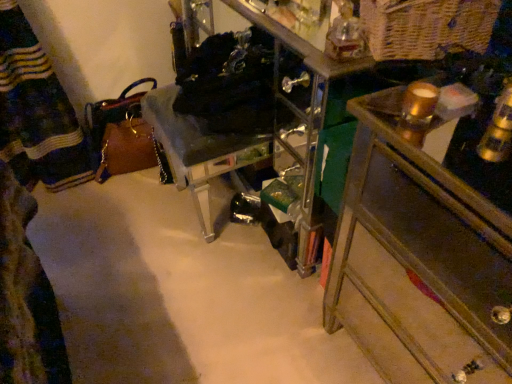
Question: Is there a large distance between woven natural basket at upper right and gold metallic candle at upper right?

Choices:
 (A) yes
 (B) no

Answer: (B)

Question: Is woven natural basket at upper right at the left side of gold metallic candle at upper right?

Choices:
 (A) no
 (B) yes

Answer: (A)

Question: Does woven natural basket at upper right have a greater height compared to gold metallic candle at upper right?

Choices:
 (A) yes
 (B) no

Answer: (A)

Question: Can you confirm if woven natural basket at upper right is wider than gold metallic candle at upper right?

Choices:
 (A) yes
 (B) no

Answer: (A)

Question: Does woven natural basket at upper right come behind gold metallic candle at upper right?

Choices:
 (A) no
 (B) yes

Answer: (B)

Question: Does woven natural basket at upper right have a lesser height compared to gold metallic candle at upper right?

Choices:
 (A) yes
 (B) no

Answer: (B)

Question: Can you confirm if wooden chest of drawers at right is positioned to the right of clear acrylic chair at center?

Choices:
 (A) yes
 (B) no

Answer: (A)

Question: Would you say wooden chest of drawers at right contains clear acrylic chair at center?

Choices:
 (A) yes
 (B) no

Answer: (B)

Question: Is wooden chest of drawers at right far from clear acrylic chair at center?

Choices:
 (A) no
 (B) yes

Answer: (A)

Question: Considering the relative sizes of wooden chest of drawers at right and clear acrylic chair at center in the image provided, is wooden chest of drawers at right thinner than clear acrylic chair at center?

Choices:
 (A) yes
 (B) no

Answer: (B)

Question: Is wooden chest of drawers at right further to the viewer compared to clear acrylic chair at center?

Choices:
 (A) no
 (B) yes

Answer: (A)

Question: Is wooden chest of drawers at right smaller than clear acrylic chair at center?

Choices:
 (A) no
 (B) yes

Answer: (A)

Question: Could you tell me if gold metallic candle at upper right is turned towards woven natural basket at upper right?

Choices:
 (A) yes
 (B) no

Answer: (B)